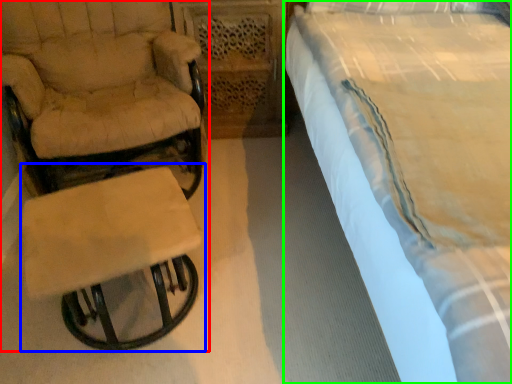
Question: Considering the real-world distances, which object is closest to chair (highlighted by a red box)? table (highlighted by a blue box) or bed (highlighted by a green box).

Choices:
 (A) table
 (B) bed

Answer: (A)